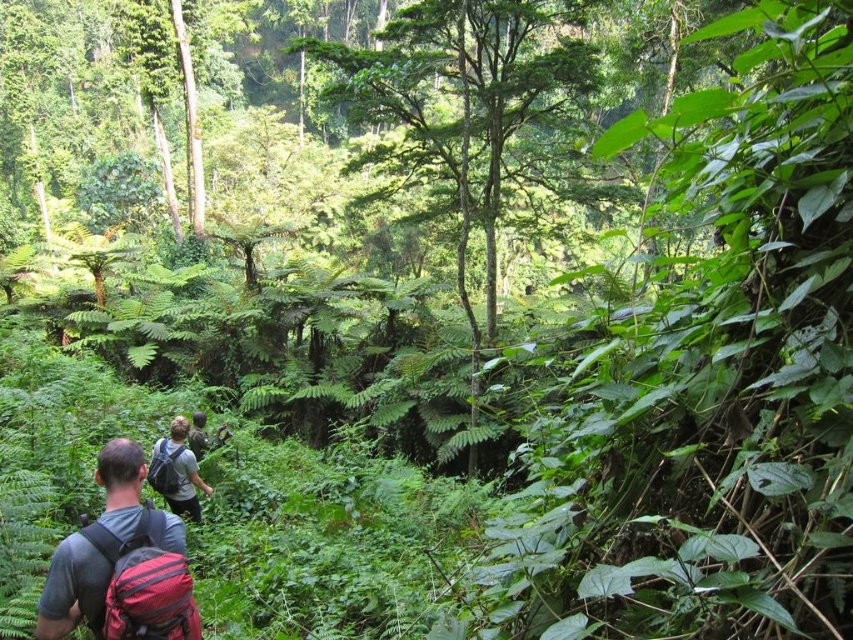
Does red fabric backpack at lower left appear over red backpack at lower left?

No.

Image resolution: width=853 pixels, height=640 pixels. I want to click on red fabric backpack at lower left, so click(144, 580).

Which is in front, point (112, 547) or point (103, 460)?

Positioned in front is point (112, 547).

The width and height of the screenshot is (853, 640). Find the location of `red fabric backpack at lower left`. red fabric backpack at lower left is located at coordinates (144, 580).

Is red fabric backpack at lower left bigger than matte red backpack at lower left?

Yes, red fabric backpack at lower left is bigger than matte red backpack at lower left.

Does red fabric backpack at lower left have a greater width compared to matte red backpack at lower left?

Correct, the width of red fabric backpack at lower left exceeds that of matte red backpack at lower left.

Does point (155, 524) lie behind point (160, 492)?

No, it is not.

This screenshot has height=640, width=853. What are the coordinates of `red fabric backpack at lower left` in the screenshot? It's located at (144, 580).

Does matte gray backpack at center appear under matte red backpack at lower left?

Yes, matte gray backpack at center is below matte red backpack at lower left.

Does matte gray backpack at center have a smaller size compared to matte red backpack at lower left?

Actually, matte gray backpack at center might be larger than matte red backpack at lower left.

In order to click on matte gray backpack at center in this screenshot , I will do [177, 470].

Identify the location of matte gray backpack at center. This screenshot has width=853, height=640. (177, 470).